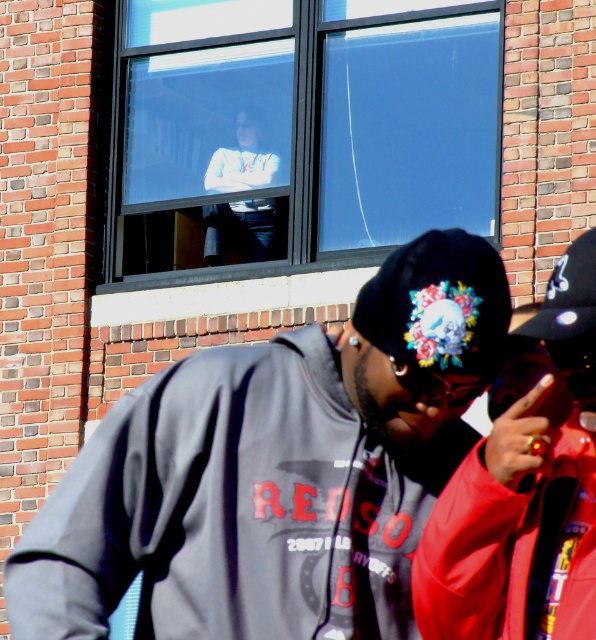
Question: Which point appears closest to the camera in this image?

Choices:
 (A) (352, 0)
 (B) (439, 516)

Answer: (B)

Question: Does transparent glass window at upper center have a lesser width compared to translucent plastic goggles at center?

Choices:
 (A) yes
 (B) no

Answer: (B)

Question: Is floral-patterned fabric baseball cap at center in front of black matte baseball cap at upper right?

Choices:
 (A) no
 (B) yes

Answer: (A)

Question: Does gray hoodie at center appear over matte gray sweatshirt at lower left?

Choices:
 (A) no
 (B) yes

Answer: (A)

Question: Which point appears closest to the camera in this image?

Choices:
 (A) (488, 368)
 (B) (514, 580)
 (C) (272, 172)

Answer: (B)

Question: Which of the following is the farthest from the observer?

Choices:
 (A) floral-patterned fabric baseball cap at center
 (B) black matte baseball cap at upper right
 (C) matte gray sweatshirt at lower left
 (D) transparent glass window at upper center

Answer: (D)